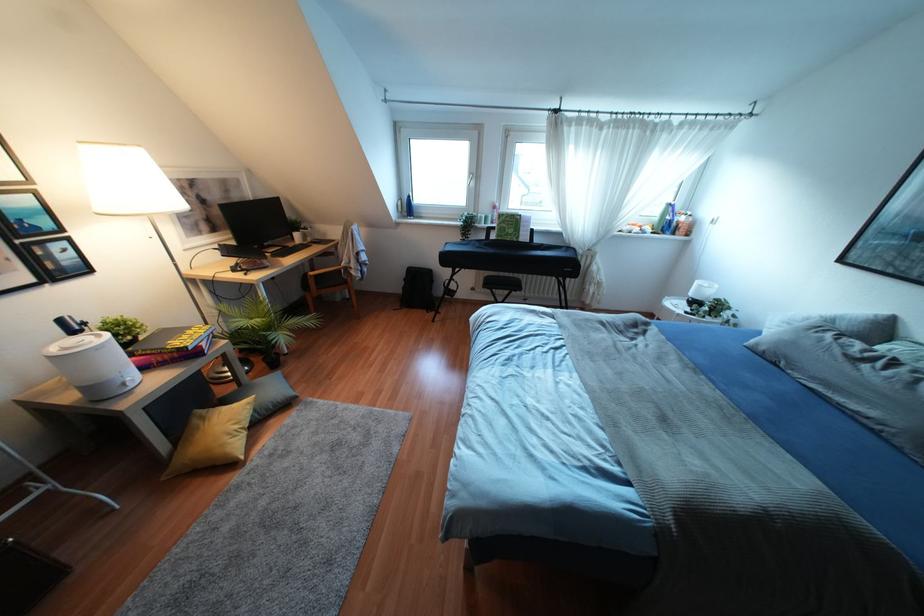
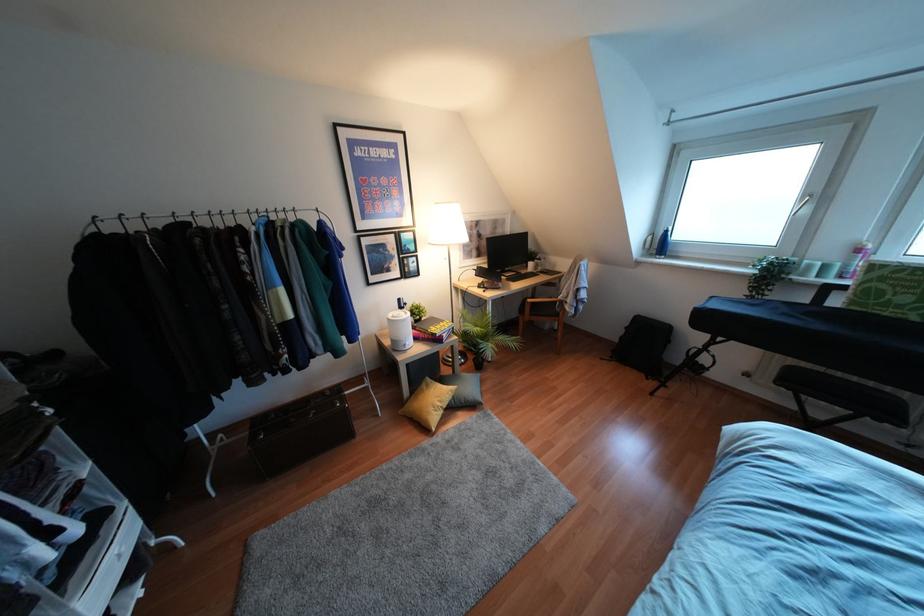
Find the pixel in the second image that matches (x=234, y=270) in the first image.

(478, 286)